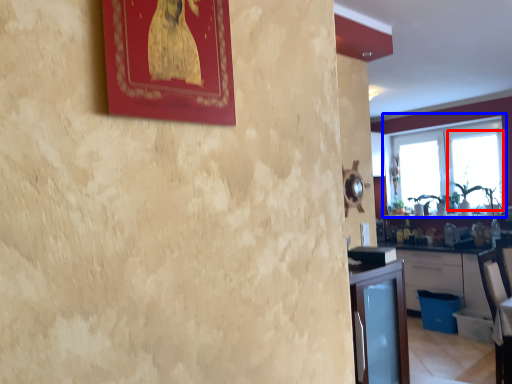
Question: Which of the following is the farthest to the observer, window screen (highlighted by a red box) or window (highlighted by a blue box)?

Choices:
 (A) window screen
 (B) window

Answer: (A)